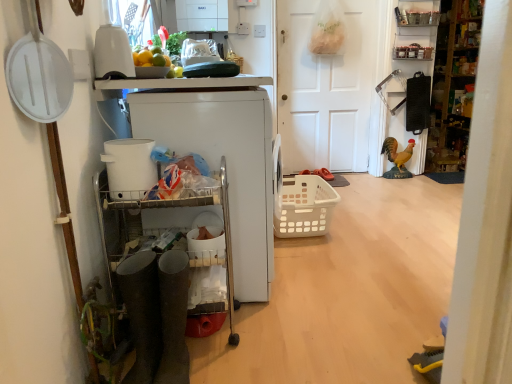
Find the location of a particular element. vacant space to the right of metallic gray boots at left, which is the 1th cabinetry in left-to-right order is located at coordinates (280, 335).